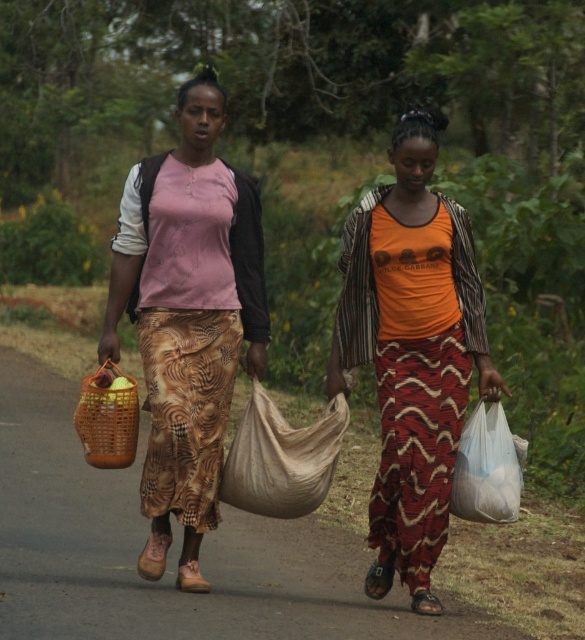
Question: Which point is closer to the camera?

Choices:
 (A) (328, 387)
 (B) (109, 433)
 (C) (273, 406)

Answer: (B)

Question: Among these objects, which one is nearest to the camera?

Choices:
 (A) matte brown woven basket at left
 (B) woven brown basket at left

Answer: (B)

Question: Which is nearer to the woven basket at center?

Choices:
 (A) matte brown woven basket at left
 (B) white plastic bag at right

Answer: (B)

Question: Is woven basket at center below beige fabric sack at center?

Choices:
 (A) yes
 (B) no

Answer: (A)

Question: Is woven basket at center smaller than orange printed shirt at center?

Choices:
 (A) no
 (B) yes

Answer: (B)

Question: Can you confirm if woven basket at center is smaller than woven brown basket at left?

Choices:
 (A) no
 (B) yes

Answer: (B)